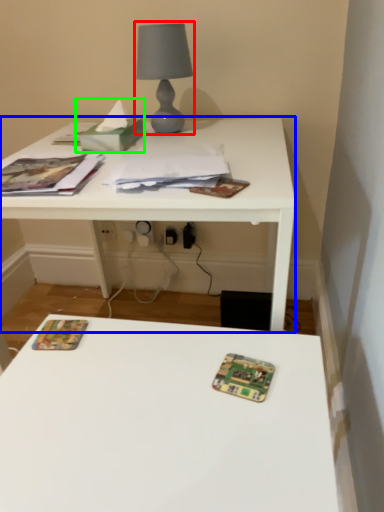
Question: Considering the real-world distances, which object is closest to table lamp (highlighted by a red box)? table (highlighted by a blue box) or tissue (highlighted by a green box).

Choices:
 (A) table
 (B) tissue

Answer: (B)